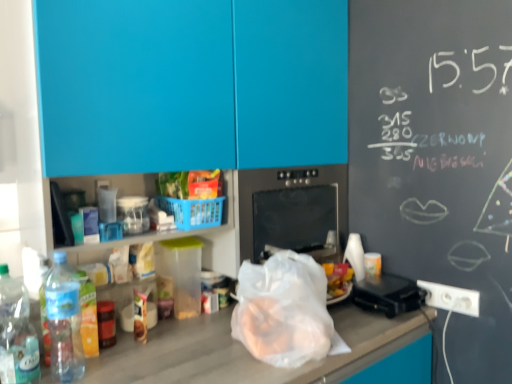
Question: Is transparent plastic bag at center taller or shorter than clear plastic bottle at lower left, the first bottle when ordered from right to left?

Choices:
 (A) tall
 (B) short

Answer: (B)

Question: Is point (241, 268) positioned closer to the camera than point (70, 321)?

Choices:
 (A) farther
 (B) closer

Answer: (A)

Question: Considering the real-world distances, which object is closest to the translucent plastic bottle at left, which is the second bottle from right to left?

Choices:
 (A) white plastic electric outlet at lower right
 (B) blue plastic basket at center
 (C) black glass oven at center
 (D) shiny plastic bag of chips at center
 (E) blue matte cabinet at upper center

Answer: (B)

Question: Estimate the real-world distances between objects in this image. Which object is closer to the black glass oven at center?

Choices:
 (A) blue matte cabinet at upper center
 (B) white plastic electric outlet at lower right
 (C) black plastic toaster at right
 (D) clear plastic bottle at lower left, the first bottle when ordered from right to left
 (E) transparent plastic bag at center

Answer: (A)